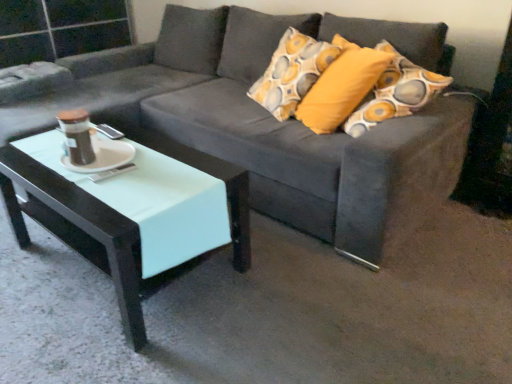
Locate an element on the screen. This screenshot has height=384, width=512. white glossy saucer at center is located at coordinates (101, 155).

What do you see at coordinates (276, 121) in the screenshot? Image resolution: width=512 pixels, height=384 pixels. I see `suede gray couch at center` at bounding box center [276, 121].

I want to click on mint glossy coffee table at lower left, so click(x=132, y=211).

Is white glossy saucer at center turned away from mint glossy coffee table at lower left?

No, mint glossy coffee table at lower left is not at the back of white glossy saucer at center.

Is white glossy saucer at center bigger or smaller than mint glossy coffee table at lower left?

white glossy saucer at center is smaller than mint glossy coffee table at lower left.

Find the location of a particular element. The image size is (512, 384). saucer that is on the left side of mint glossy coffee table at lower left is located at coordinates (101, 155).

Considering the relative sizes of white glossy saucer at center and mint glossy coffee table at lower left in the image provided, is white glossy saucer at center taller than mint glossy coffee table at lower left?

No, white glossy saucer at center is not taller than mint glossy coffee table at lower left.

Considering the relative sizes of mint glossy coffee table at lower left and white glossy saucer at center in the image provided, is mint glossy coffee table at lower left wider than white glossy saucer at center?

Yes, mint glossy coffee table at lower left is wider than white glossy saucer at center.

Are mint glossy coffee table at lower left and white glossy saucer at center located far from each other?

No, mint glossy coffee table at lower left is not far from white glossy saucer at center.

Considering the sizes of mint glossy coffee table at lower left and white glossy saucer at center in the image, is mint glossy coffee table at lower left bigger or smaller than white glossy saucer at center?

Considering their sizes, mint glossy coffee table at lower left takes up more space than white glossy saucer at center.

In terms of size, does suede gray couch at center appear bigger or smaller than white glossy saucer at center?

Considering their sizes, suede gray couch at center takes up more space than white glossy saucer at center.

From a real-world perspective, is suede gray couch at center physically located above or below white glossy saucer at center?

Clearly, from a real-world perspective, suede gray couch at center is below white glossy saucer at center.

Where is `studio couch above the white glossy saucer at center (from the image's perspective)`? Image resolution: width=512 pixels, height=384 pixels. studio couch above the white glossy saucer at center (from the image's perspective) is located at coordinates point(276,121).

Which is behind, point (467, 127) or point (109, 167)?

Point (467, 127)

Who is taller, white glossy saucer at center or suede gray couch at center?

With more height is suede gray couch at center.

Which object is closer to the camera taking this photo, white glossy saucer at center or suede gray couch at center?

Positioned in front is suede gray couch at center.

Where is `saucer above the suede gray couch at center (from a real-world perspective)`? Image resolution: width=512 pixels, height=384 pixels. saucer above the suede gray couch at center (from a real-world perspective) is located at coordinates (101, 155).

Considering the relative positions of white glossy saucer at center and suede gray couch at center in the image provided, is white glossy saucer at center to the left of suede gray couch at center from the viewer's perspective?

Correct, you'll find white glossy saucer at center to the left of suede gray couch at center.

Between mint glossy coffee table at lower left and suede gray couch at center, which one has larger width?

suede gray couch at center is wider.

From a real-world perspective, is mint glossy coffee table at lower left over suede gray couch at center?

No, from a real-world perspective, mint glossy coffee table at lower left is not above suede gray couch at center.

Considering the relative positions of mint glossy coffee table at lower left and suede gray couch at center in the image provided, is mint glossy coffee table at lower left to the left or to the right of suede gray couch at center?

mint glossy coffee table at lower left is positioned on suede gray couch at center's left side.

Considering the positions of points (234, 181) and (343, 195), is point (234, 181) farther from camera compared to point (343, 195)?

No, it is in front of (343, 195).

Identify the location of coffee table below the suede gray couch at center (from the image's perspective). The image size is (512, 384). (132, 211).

Is suede gray couch at center not near mint glossy coffee table at lower left?

No, suede gray couch at center is in close proximity to mint glossy coffee table at lower left.

Is mint glossy coffee table at lower left inside suede gray couch at center?

Yes, mint glossy coffee table at lower left is a part of suede gray couch at center.

Is suede gray couch at center oriented away from mint glossy coffee table at lower left?

No, suede gray couch at center is not facing away from mint glossy coffee table at lower left.

I want to click on saucer above the mint glossy coffee table at lower left (from a real-world perspective), so click(x=101, y=155).

This screenshot has height=384, width=512. I want to click on coffee table to the right of white glossy saucer at center, so click(x=132, y=211).

Based on their spatial positions, is mint glossy coffee table at lower left or white glossy saucer at center further from suede gray couch at center?

Among the two, white glossy saucer at center is located further to suede gray couch at center.

Looking at the image, which one is located further to white glossy saucer at center, suede gray couch at center or mint glossy coffee table at lower left?

suede gray couch at center.

When comparing their distances from white glossy saucer at center, does mint glossy coffee table at lower left or suede gray couch at center seem further?

suede gray couch at center lies further to white glossy saucer at center than the other object.

Estimate the real-world distances between objects in this image. Which object is closer to mint glossy coffee table at lower left, white glossy saucer at center or suede gray couch at center?

Based on the image, white glossy saucer at center appears to be nearer to mint glossy coffee table at lower left.

Based on their spatial positions, is suede gray couch at center or white glossy saucer at center closer to mint glossy coffee table at lower left?

white glossy saucer at center.

Based on their spatial positions, is white glossy saucer at center or mint glossy coffee table at lower left further from suede gray couch at center?

Among the two, white glossy saucer at center is located further to suede gray couch at center.

Where is `coffee table between white glossy saucer at center and suede gray couch at center from left to right`? The image size is (512, 384). coffee table between white glossy saucer at center and suede gray couch at center from left to right is located at coordinates (132, 211).